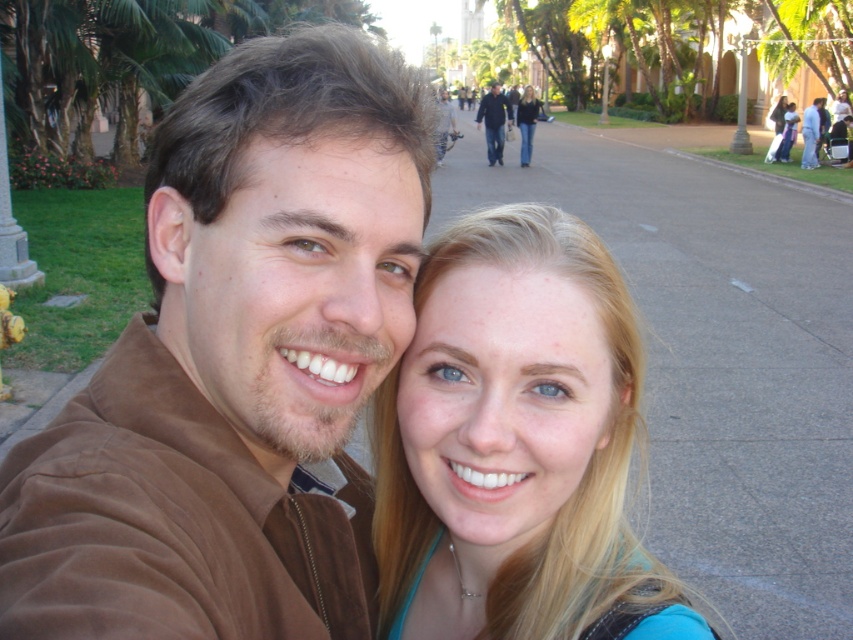
Is matte brown jacket at upper right taller than blue jeans at center?

Incorrect, matte brown jacket at upper right's height is not larger of blue jeans at center's.

Which is more to the left, matte brown jacket at upper right or blue jeans at center?

From the viewer's perspective, blue jeans at center appears more on the left side.

Between point (813, 150) and point (525, 140), which one is positioned in front?

Point (813, 150)

Where is `matte brown jacket at upper right`? Image resolution: width=853 pixels, height=640 pixels. matte brown jacket at upper right is located at coordinates (811, 132).

Does blonde hair at center have a smaller size compared to matte brown jacket at upper right?

Yes, blonde hair at center is smaller than matte brown jacket at upper right.

Looking at this image, which of these two, blonde hair at center or matte brown jacket at upper right, stands shorter?

Standing shorter between the two is blonde hair at center.

Where is `blonde hair at center`? The image size is (853, 640). blonde hair at center is located at coordinates (515, 444).

Between point (235, 426) and point (788, 116), which one is positioned in front?

Point (235, 426) is more forward.

Between brown suede jacket at upper left and blonde hair at upper center, which one is positioned higher?

blonde hair at upper center is above.

Describe the element at coordinates (236, 364) in the screenshot. I see `brown suede jacket at upper left` at that location.

Where is `brown suede jacket at upper left`? The height and width of the screenshot is (640, 853). brown suede jacket at upper left is located at coordinates (236, 364).